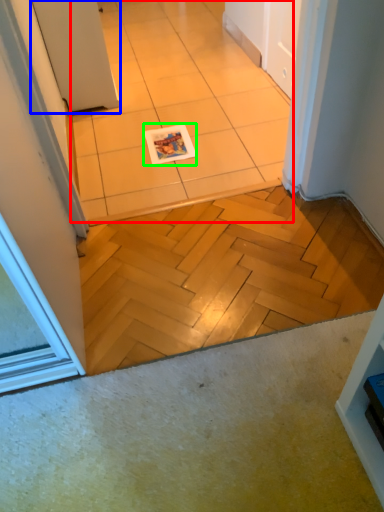
Question: Which is nearer to the ceramic tile (highlighted by a red box)? door (highlighted by a blue box) or magazine (highlighted by a green box).

Choices:
 (A) door
 (B) magazine

Answer: (B)